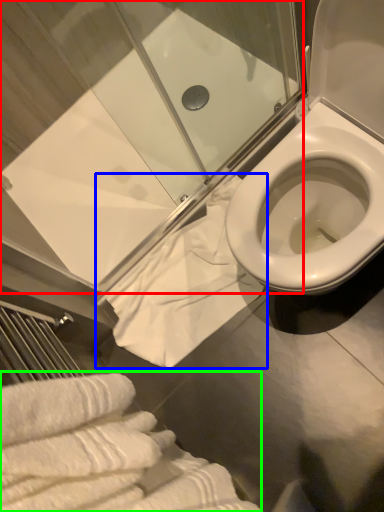
Question: Which object is the farthest from shower door (highlighted by a red box)? Choose among these: bath towel (highlighted by a blue box) or bath towel (highlighted by a green box).

Choices:
 (A) bath towel
 (B) bath towel

Answer: (B)